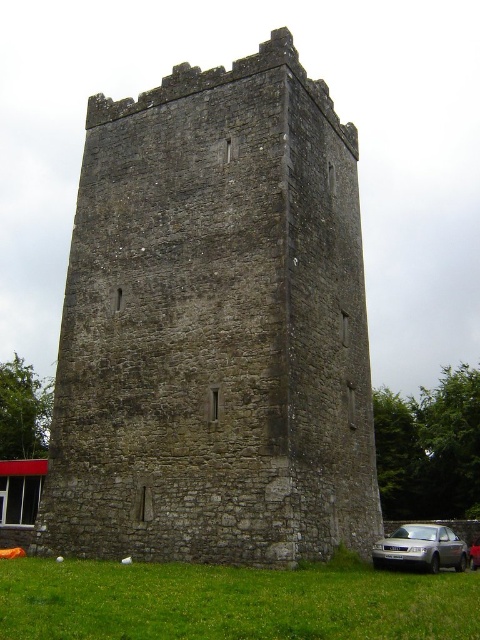
Does gray stone tower at center have a lesser height compared to green grass at lower center?

No.

Is gray stone tower at center wider than green grass at lower center?

In fact, gray stone tower at center might be narrower than green grass at lower center.

Based on the photo, who is more forward, (233,209) or (36,563)?

Point (36,563) is more forward.

The width and height of the screenshot is (480, 640). Find the location of `gray stone tower at center`. gray stone tower at center is located at coordinates coord(215,326).

Is gray stone tower at center taller than satin silver car at lower right?

Yes, gray stone tower at center is taller than satin silver car at lower right.

Between gray stone tower at center and satin silver car at lower right, which one has less height?

satin silver car at lower right

What do you see at coordinates (215, 326) in the screenshot? I see `gray stone tower at center` at bounding box center [215, 326].

Find the location of a particular element. gray stone tower at center is located at coordinates (215, 326).

Which of these two, green grass at lower center or satin silver car at lower right, stands shorter?

With less height is satin silver car at lower right.

Between green grass at lower center and satin silver car at lower right, which one is positioned lower?

satin silver car at lower right is lower down.

Is point (100, 632) closer to camera compared to point (476, 556)?

That is True.

Where is `green grass at lower center`? The image size is (480, 640). green grass at lower center is located at coordinates (230, 602).